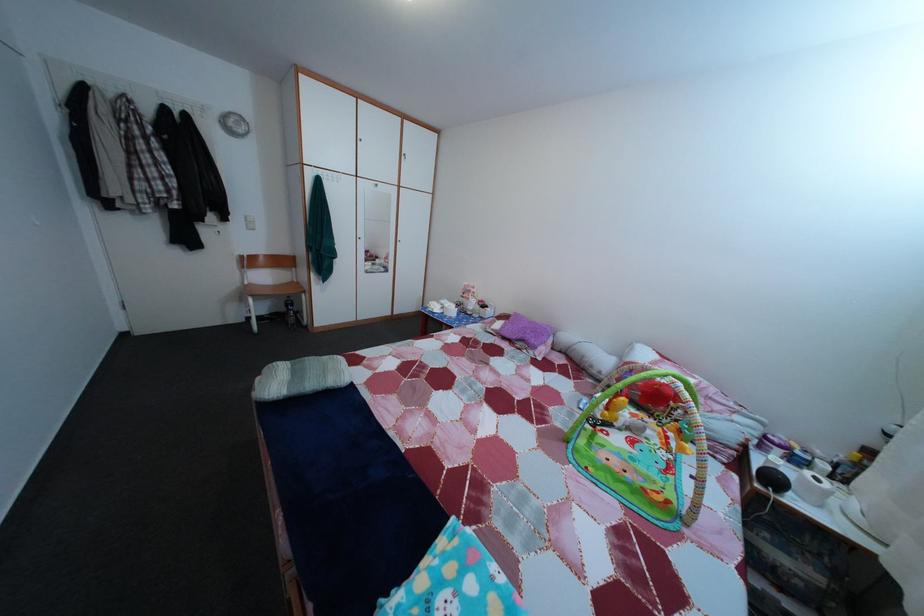
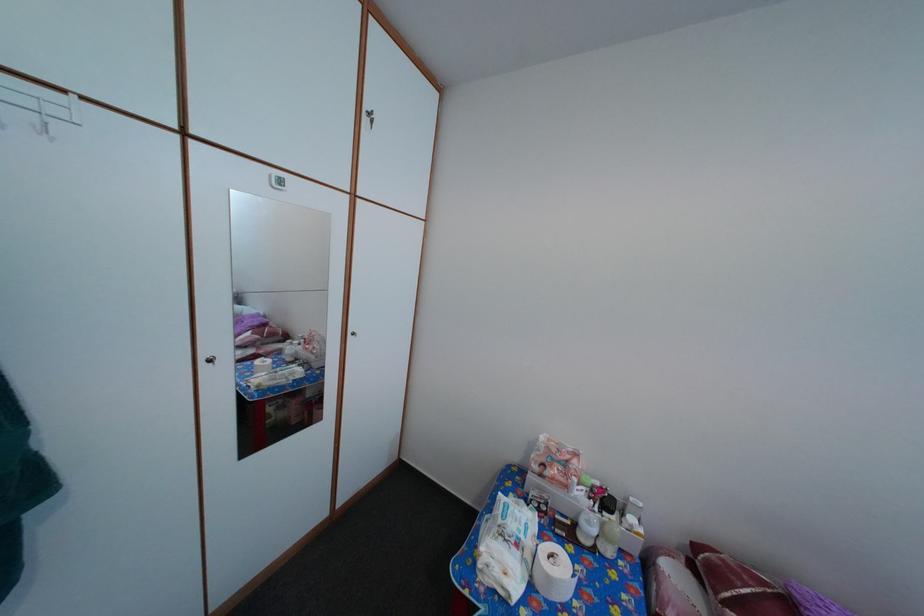
In the second image, find the point that corresponds to point 480,299 in the first image.

(576, 469)